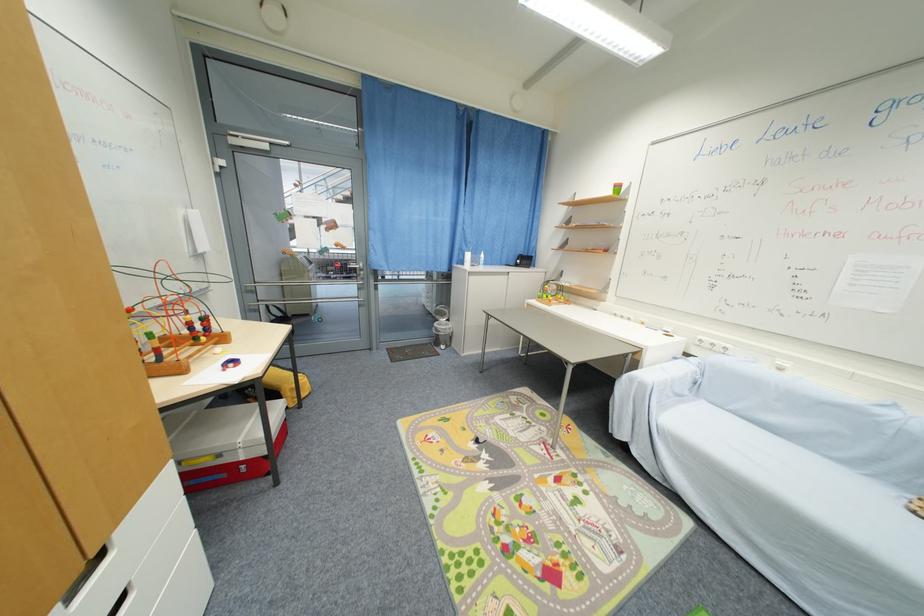
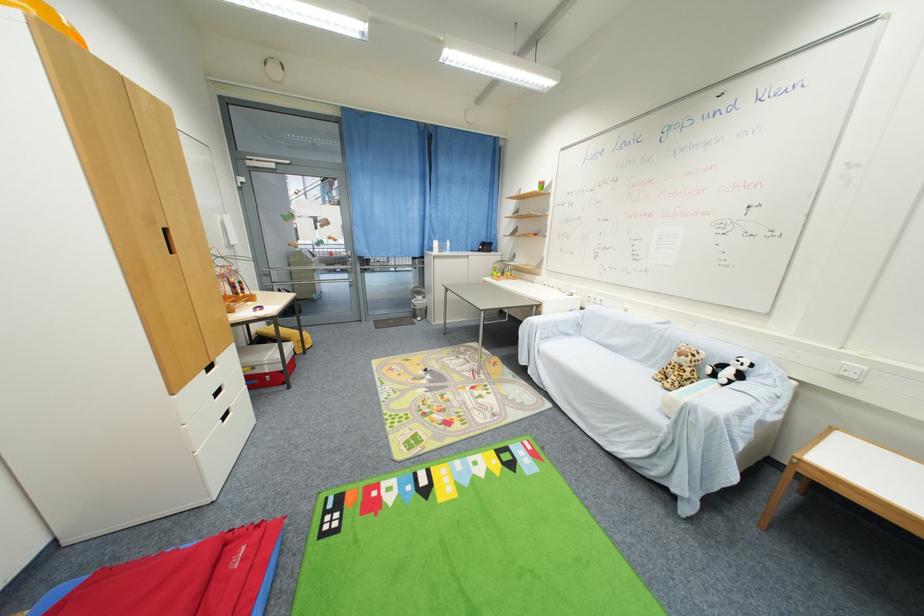
The point at (648, 387) is marked in the first image. Where is the corresponding point in the second image?

(537, 326)